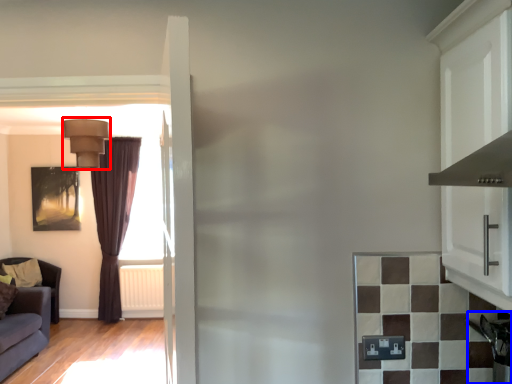
Question: Which of the following is the closest to the observer, light fixture (highlighted by a red box) or appliance (highlighted by a blue box)?

Choices:
 (A) light fixture
 (B) appliance

Answer: (B)